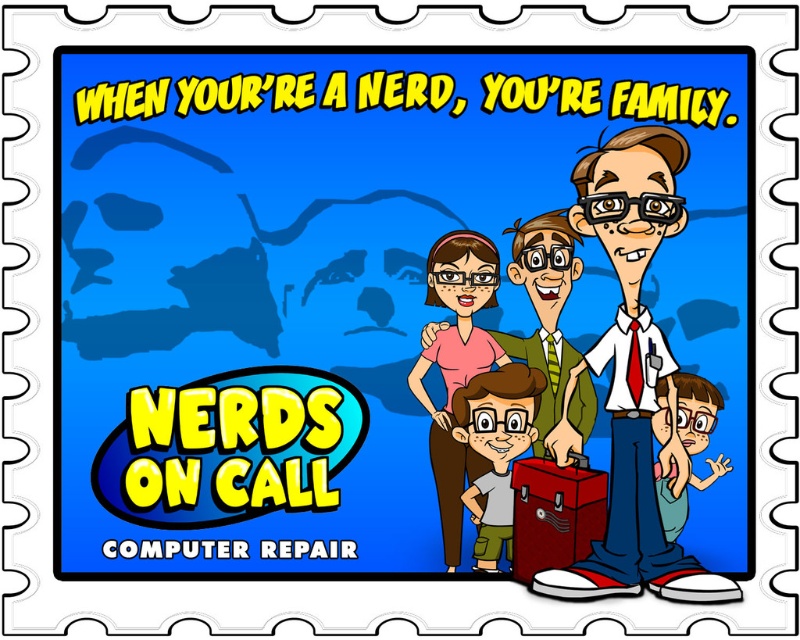
Question: Considering the real-world distances, which object is farthest from the matte red toolbox at center?

Choices:
 (A) matte white shirt at center
 (B) pink fabric shirt at center
 (C) green fabric shirt at lower right

Answer: (C)

Question: In this image, where is light brown skin tone at center located relative to green fabric shirt at lower right?

Choices:
 (A) left
 (B) right

Answer: (A)

Question: Is pink fabric shirt at center positioned at the back of green fabric shirt at lower right?

Choices:
 (A) yes
 (B) no

Answer: (A)

Question: Is light brown skin tone at center further to camera compared to green fabric shirt at lower right?

Choices:
 (A) no
 (B) yes

Answer: (B)

Question: Which of the following is the closest to the observer?

Choices:
 (A) (440, 256)
 (B) (336, 403)
 (C) (670, 474)
 (D) (480, 380)

Answer: (C)

Question: Which point appears closest to the camera in this image?

Choices:
 (A) (678, 385)
 (B) (572, 417)
 (C) (480, 394)
 (D) (432, 291)

Answer: (A)